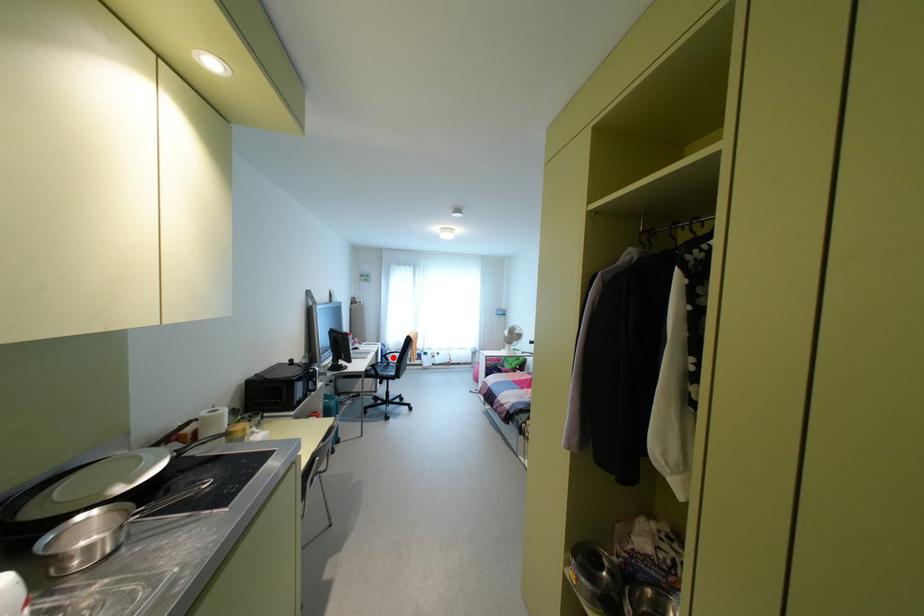
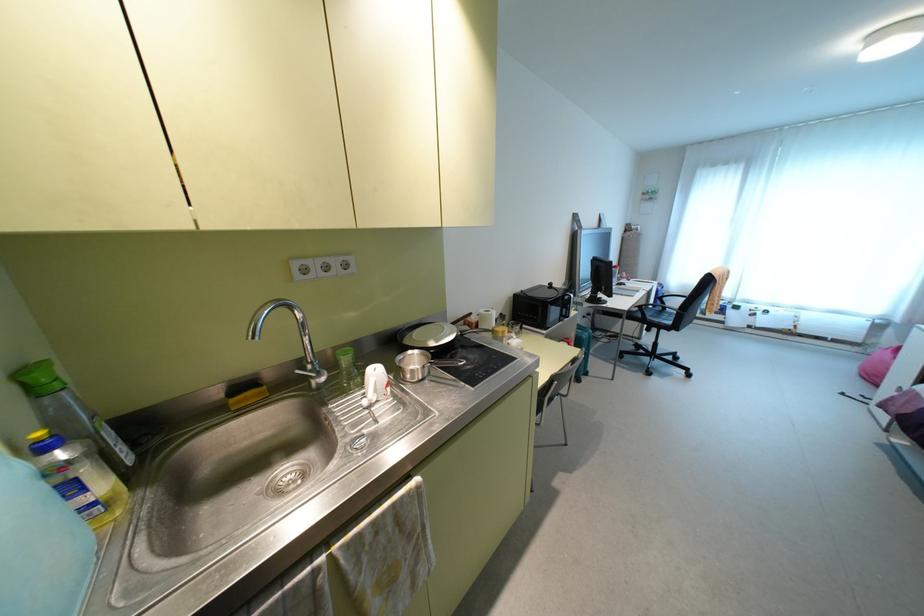
Question: I am providing you with two images of the same scene from different viewpoints. A red point is shown in image1. For the corresponding object point in image2, is it positioned nearer or farther from the camera?

Choices:
 (A) Nearer
 (B) Farther

Answer: (A)